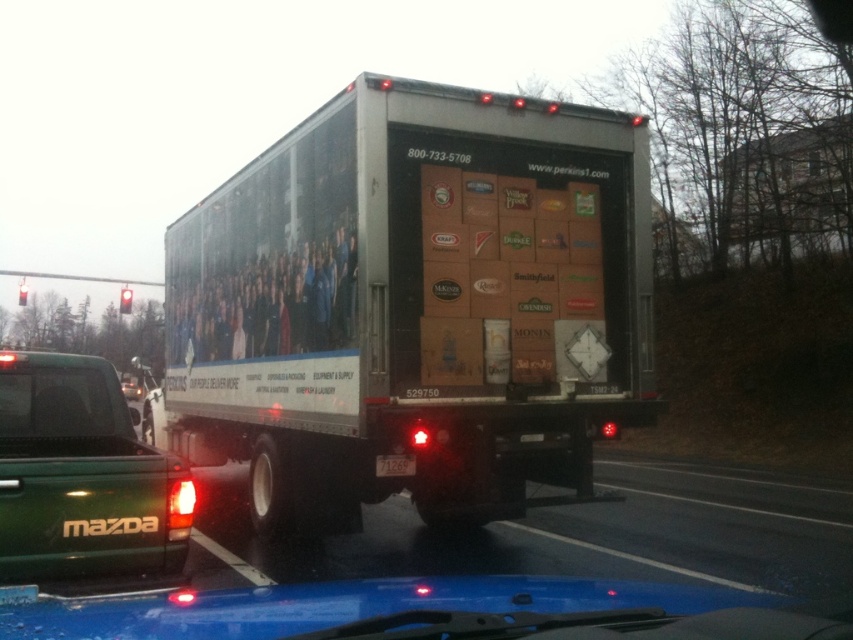
You are standing at the point where the viewer is located. You want to throw a ball to hit the point at coordinates point [619,381]. If you can throw the ball up to 6 meters, will you be able to reach it?

The point [619,381] is 6.33 meters away from the viewer, which is beyond your throwing range of 6 meters. Therefore, you cannot reach it.

You are a delivery person standing at the back of the truck. You see two points marked on the trailer. The first point is at coordinates point (x=13, y=404) and the second point is at point (x=415, y=467). Which point is closer to you?

Point (x=13, y=404) is in front of point (x=415, y=467), so the first point is closer to you.

You are a pedestrian standing at the crosswalk and see the silver metallic trailer truck at center and the green matte truck at lower left. Which truck is closer to the crosswalk?

The green matte truck at lower left is closer to the crosswalk because the silver metallic trailer truck at center is positioned on the right side of it, meaning the green truck is between the crosswalk and the silver truck.